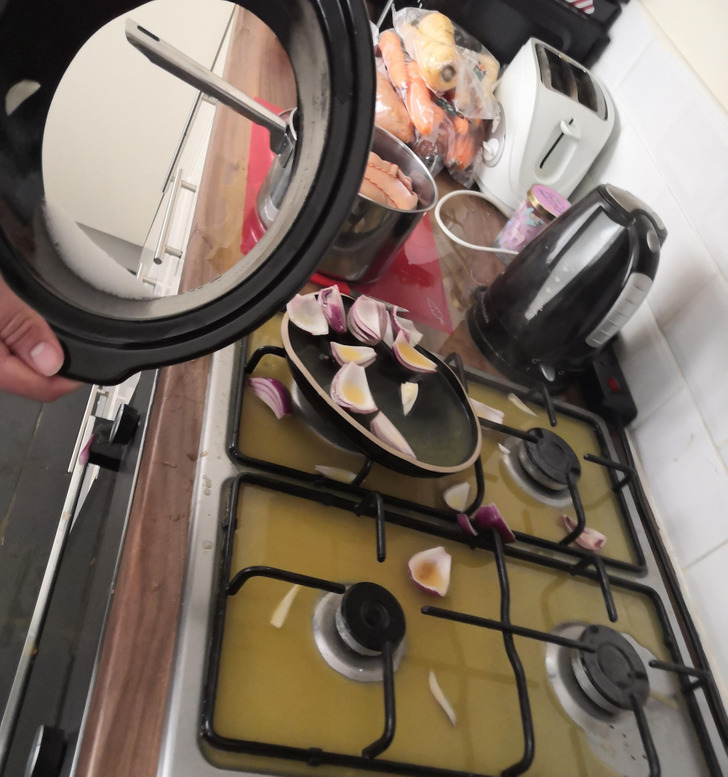
Find the location of a particular element. silver pot is located at coordinates (362, 248).